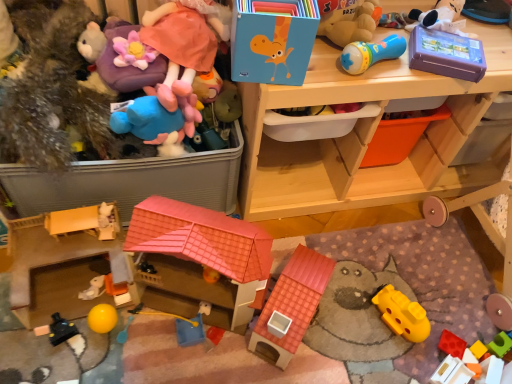
Locate an element on the screen. The height and width of the screenshot is (384, 512). vacant space to the right of white plush toy at lower left, the twelfth toy from the right is located at coordinates (149, 329).